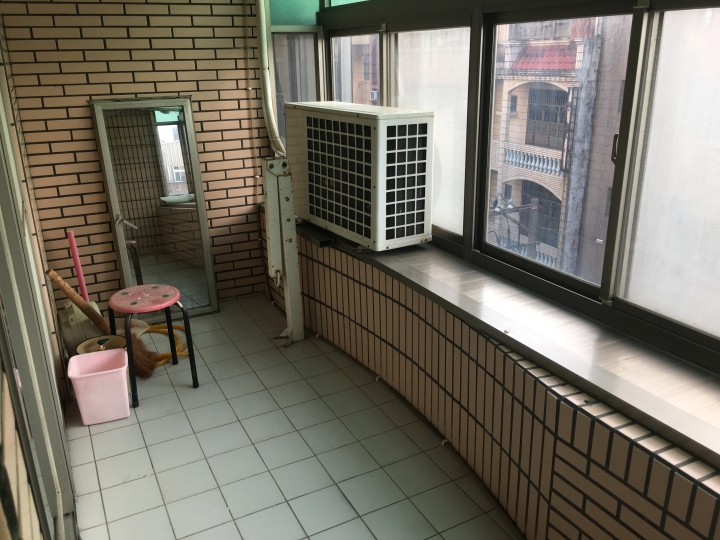
You are a GUI agent. You are given a task and a screenshot of the screen. Output one action in this format:
    pyautogui.click(x=<x>, y=<y>)
    Task: Click on the window latch
    This screenshot has width=720, height=540.
    Given the screenshot: What is the action you would take?
    pyautogui.click(x=612, y=146)